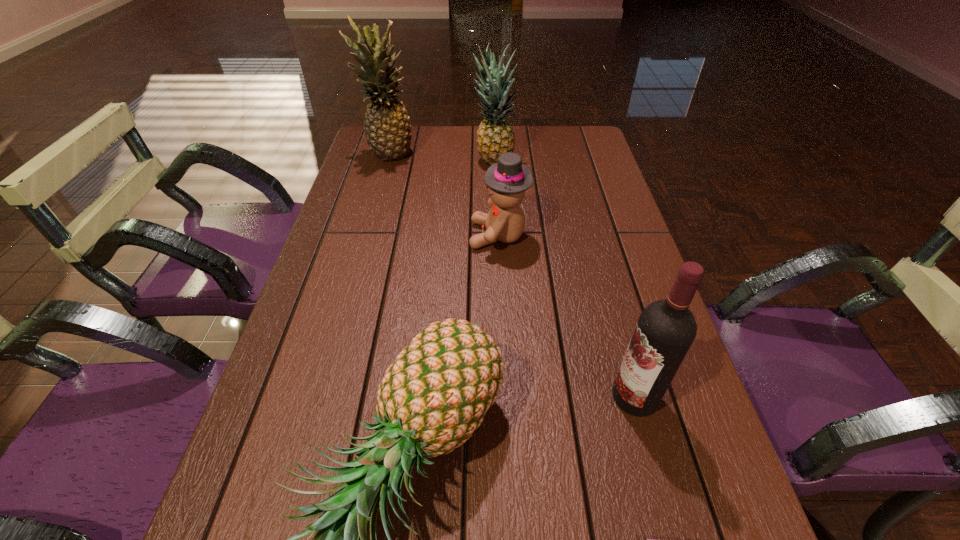
Find the location of a particular element. This screenshot has height=540, width=960. the second tallest pineapple is located at coordinates coord(495,135).

Where is `wine bottle`? wine bottle is located at coordinates (666, 329).

At what (x,y) coordinates should I click in order to perform the action: click on the third farthest object. Please return your answer as a coordinate pair (x, y). The image size is (960, 540). Looking at the image, I should click on (507, 180).

Identify the location of free space located 0.170m on the right of the second shortest pineapple. (568, 163).

Locate an element on the screen. The width and height of the screenshot is (960, 540). blank area located on the label of the wine bottle is located at coordinates (483, 396).

This screenshot has width=960, height=540. What are the coordinates of `free space located on the label of the wine bottle` in the screenshot? It's located at (493, 396).

This screenshot has height=540, width=960. In order to click on blank space located 0.140m on the label of the wine bottle in this screenshot , I will do `click(537, 396)`.

Where is `vacant space located 0.230m on the front-facing side of the fourth nearest object`? This screenshot has height=540, width=960. vacant space located 0.230m on the front-facing side of the fourth nearest object is located at coordinates (381, 235).

Find the location of a particular element. vacant area situated on the front-facing side of the fourth nearest object is located at coordinates click(x=450, y=235).

You are a GUI agent. You are given a task and a screenshot of the screen. Output one action in this format:
    pyautogui.click(x=<x>, y=<y>)
    Task: Click on the free point located 0.260m on the front-facing side of the fourth nearest object
    The width and height of the screenshot is (960, 540).
    Given the screenshot: What is the action you would take?
    pyautogui.click(x=370, y=235)